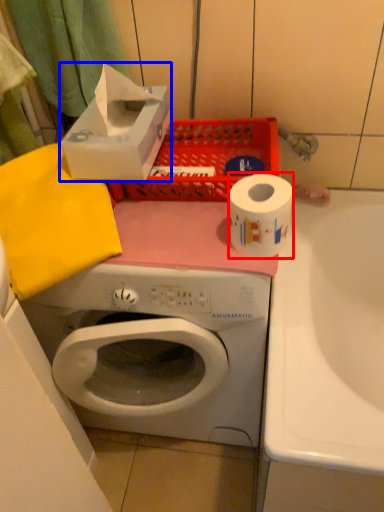
Question: Which object appears farthest to the camera in this image, toilet paper (highlighted by a red box) or storage box (highlighted by a blue box)?

Choices:
 (A) toilet paper
 (B) storage box

Answer: (B)